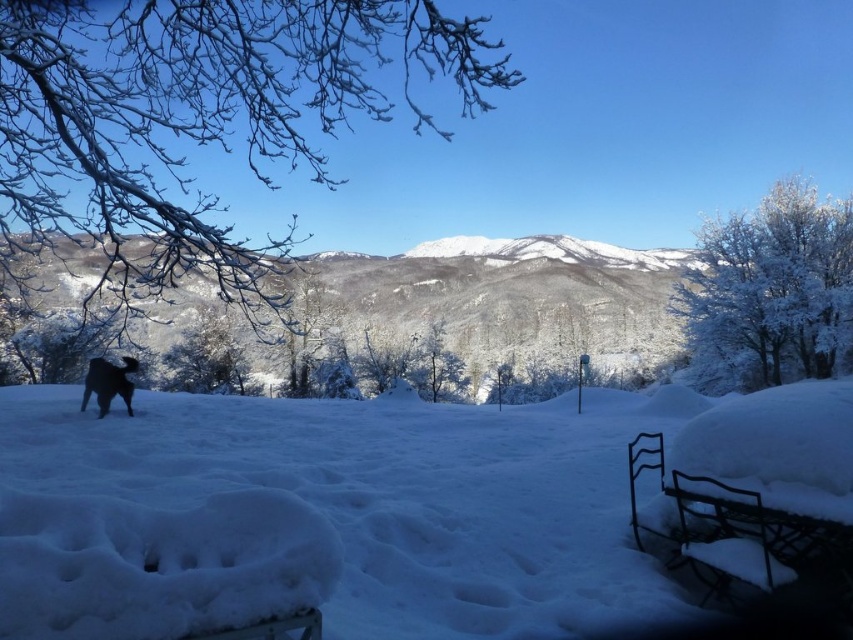
Question: Does white fluffy snow at lower left appear on the right side of black fur dog at lower left?

Choices:
 (A) no
 (B) yes

Answer: (B)

Question: Which point appears closest to the camera in this image?

Choices:
 (A) (502, 307)
 (B) (109, 403)

Answer: (B)

Question: Estimate the real-world distances between objects in this image. Which object is closer to the black fur dog at lower left?

Choices:
 (A) white fluffy snow at lower left
 (B) snow-covered mountain at center

Answer: (A)

Question: Is snow-covered mountain at center to the right of black fur dog at lower left from the viewer's perspective?

Choices:
 (A) no
 (B) yes

Answer: (B)

Question: Which of these objects is positioned farthest from the snow-covered mountain at center?

Choices:
 (A) white fluffy snow at lower left
 (B) black fur dog at lower left

Answer: (B)

Question: Where is snow-covered mountain at center located in relation to black fur dog at lower left in the image?

Choices:
 (A) right
 (B) left

Answer: (A)